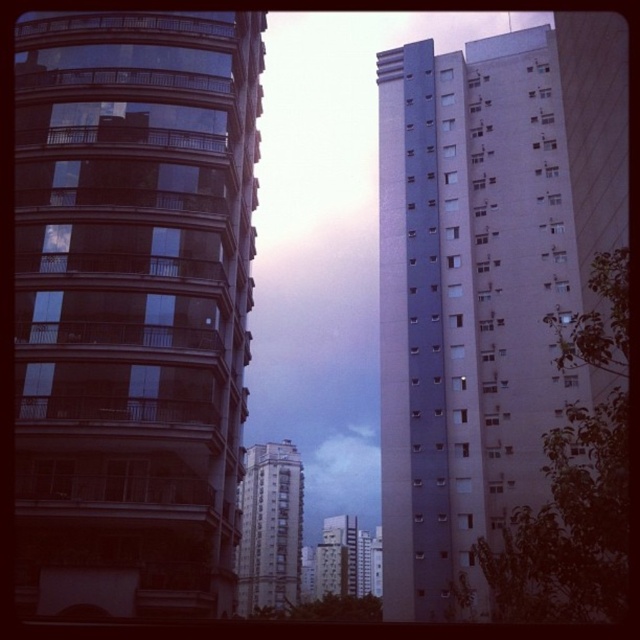
Is light gray concrete building at right to the left of white smooth building at center from the viewer's perspective?

In fact, light gray concrete building at right is to the right of white smooth building at center.

The image size is (640, 640). I want to click on light gray concrete building at right, so click(486, 280).

Measure the distance from glassy reflective building at left to white smooth building at center.

glassy reflective building at left is 723.64 feet away from white smooth building at center.

Can you confirm if glassy reflective building at left is positioned below white smooth building at center?

No, glassy reflective building at left is not below white smooth building at center.

Measure the distance between point (220, 426) and camera.

Point (220, 426) is 182.14 feet away from camera.

What are the coordinates of `glassy reflective building at left` in the screenshot? It's located at (132, 307).

Is light gray concrete building at right taller than white concrete building at center?

No.

Which of these two, light gray concrete building at right or white concrete building at center, stands taller?

With more height is white concrete building at center.

Measure the distance between point (452, 588) and camera.

The distance of point (452, 588) from camera is 217.22 feet.

Where is `light gray concrete building at right`? The height and width of the screenshot is (640, 640). light gray concrete building at right is located at coordinates (486, 280).